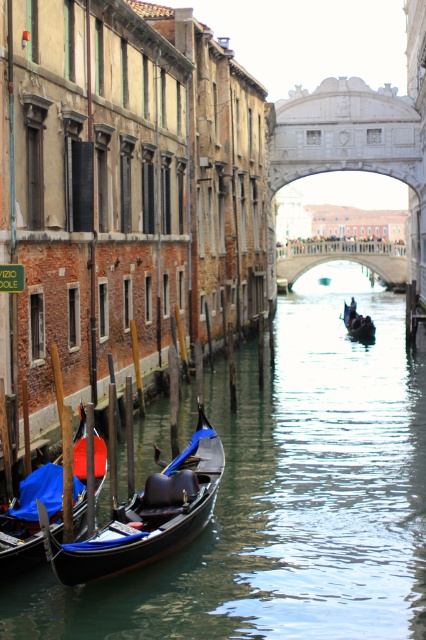
Who is positioned more to the left, white stone bridge at center or black polished wood gondola at center?

From the viewer's perspective, black polished wood gondola at center appears more on the left side.

Is point (399, 280) closer to viewer compared to point (347, 305)?

No, it is not.

Where is `white stone bridge at center`? white stone bridge at center is located at coordinates (342, 259).

Can you confirm if clear water at canal center is bigger than black polished wood gondola at center?

Yes.

Between clear water at canal center and black polished wood gondola at center, which one has less height?

black polished wood gondola at center

Identify the location of clear water at canal center. This screenshot has width=426, height=640. (284, 497).

Between blue velvet gondola at lower left and white stone bridge at center, which one appears on the left side from the viewer's perspective?

Positioned to the left is blue velvet gondola at lower left.

Does point (28, 476) lie in front of point (296, 276)?

Yes, point (28, 476) is closer to viewer.

Between point (57, 531) and point (291, 272), which one is positioned behind?

The point (291, 272) is behind.

You are a GUI agent. You are given a task and a screenshot of the screen. Output one action in this format:
    pyautogui.click(x=<x>, y=<y>)
    Task: Click on the blue velvet gondola at lower left
    This screenshot has width=426, height=640.
    Given the screenshot: What is the action you would take?
    pyautogui.click(x=29, y=520)